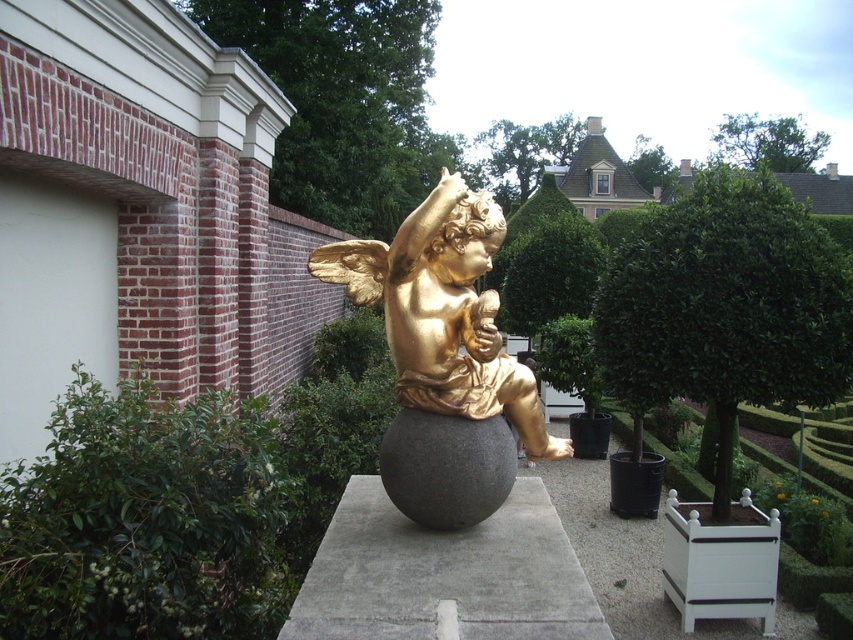
Question: Which object is the farthest from the green leafy hedge at left?

Choices:
 (A) gold polished statue at center
 (B) gray concrete at center

Answer: (A)

Question: Can you confirm if green leafy hedge at left is positioned to the right of gray concrete at center?

Choices:
 (A) yes
 (B) no

Answer: (B)

Question: Which point is closer to the camera?

Choices:
 (A) (329, 557)
 (B) (152, 584)

Answer: (B)

Question: Which of these objects is positioned closest to the gold polished statue at center?

Choices:
 (A) gray concrete at center
 (B) green leafy hedge at left

Answer: (A)

Question: Observing the image, what is the correct spatial positioning of green leafy hedge at left in reference to gold polished statue at center?

Choices:
 (A) right
 (B) left

Answer: (B)

Question: Where is green leafy hedge at left located in relation to gold polished statue at center in the image?

Choices:
 (A) left
 (B) right

Answer: (A)